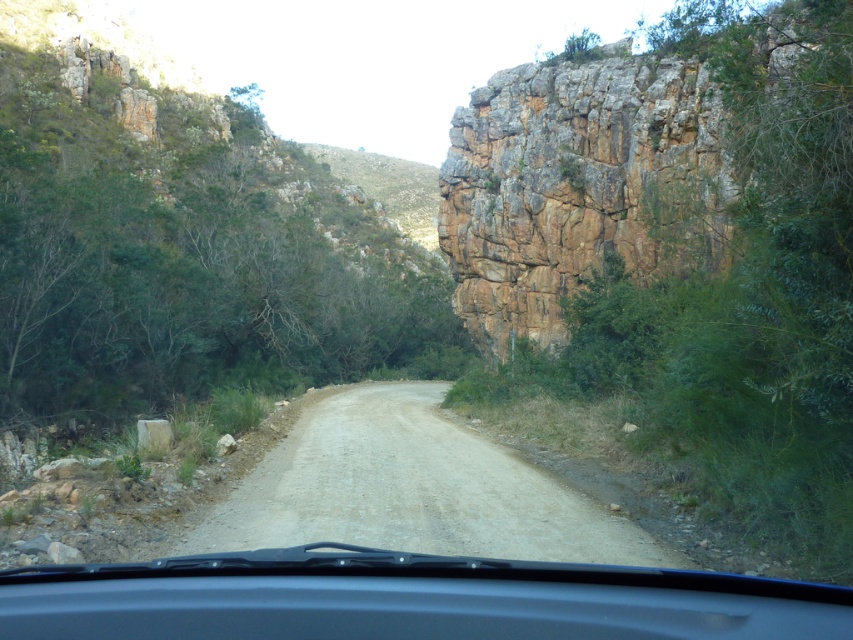
Question: Which point is closer to the camera?

Choices:
 (A) click(73, 588)
 (B) click(369, 493)
 (C) click(596, 198)

Answer: (A)

Question: Which point is closer to the camera?

Choices:
 (A) dusty gravel road at center
 (B) transparent plastic windshield at center

Answer: (B)

Question: Can you confirm if brown rough rock face at right is positioned below transparent plastic windshield at center?

Choices:
 (A) no
 (B) yes

Answer: (A)

Question: Can you confirm if transparent plastic windshield at center is thinner than dusty gravel road at center?

Choices:
 (A) no
 (B) yes

Answer: (B)

Question: Which point is closer to the camera taking this photo?

Choices:
 (A) (590, 232)
 (B) (450, 576)
 (C) (381, 404)

Answer: (B)

Question: Is brown rough rock face at right positioned in front of transparent plastic windshield at center?

Choices:
 (A) yes
 (B) no

Answer: (B)